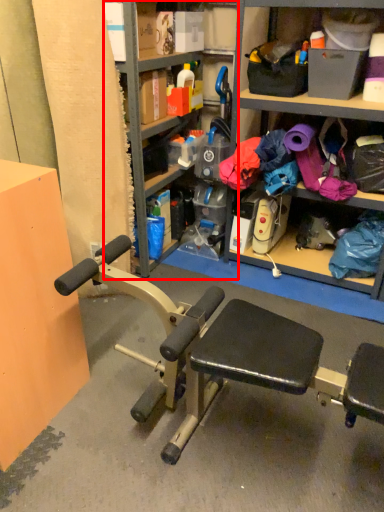
Question: Observing the image, what is the correct spatial positioning of bookshelf (annotated by the red box) in reference to shelf?

Choices:
 (A) right
 (B) left

Answer: (B)